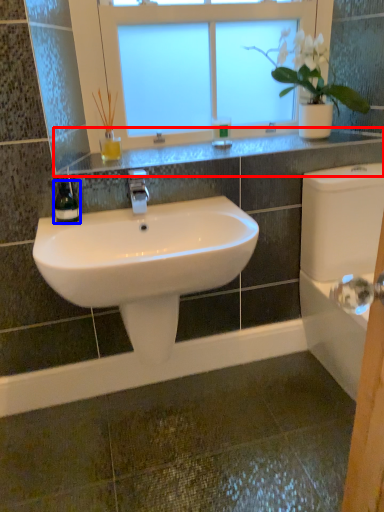
Question: Which object is further to the camera taking this photo, window sill (highlighted by a red box) or soap dispenser (highlighted by a blue box)?

Choices:
 (A) window sill
 (B) soap dispenser

Answer: (A)